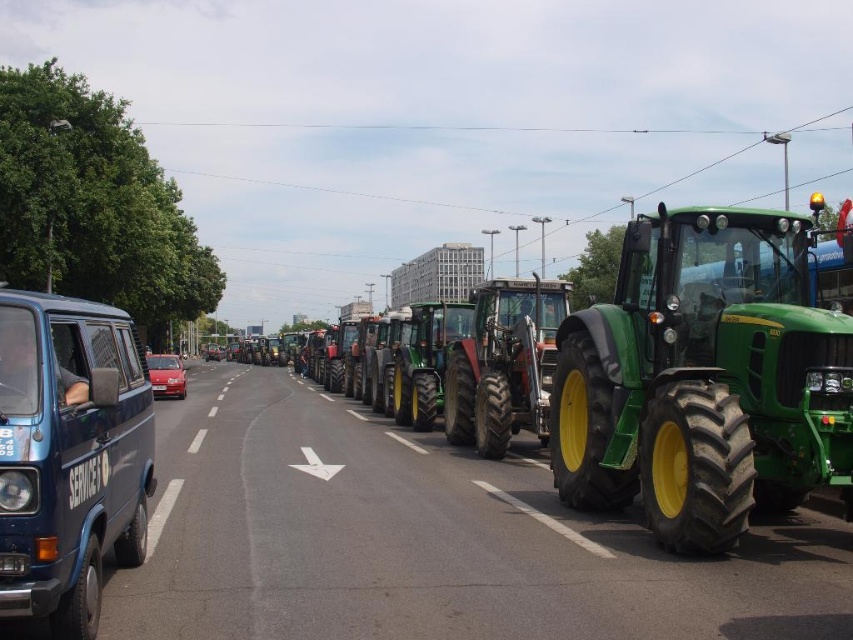
Does yellow rubber tire at lower right appear over shiny red car at center?

Yes, yellow rubber tire at lower right is above shiny red car at center.

The height and width of the screenshot is (640, 853). Identify the location of yellow rubber tire at lower right. (544, 520).

Who is more forward, (165, 384) or (155, 529)?

Point (155, 529)

Between shiny red car at center and white solid line at center, which one is positioned lower?

shiny red car at center is lower down.

Between point (173, 381) and point (172, 499), which one is positioned behind?

Positioned behind is point (173, 381).

Where is `shiny red car at center`? shiny red car at center is located at coordinates (166, 374).

Which is behind, point (708, 484) or point (47, 358)?

The point (708, 484) is behind.

Does green matte tractor at center have a greater width compared to blue matte van at left?

Correct, the width of green matte tractor at center exceeds that of blue matte van at left.

Where is `green matte tractor at center`? The image size is (853, 640). green matte tractor at center is located at coordinates (703, 380).